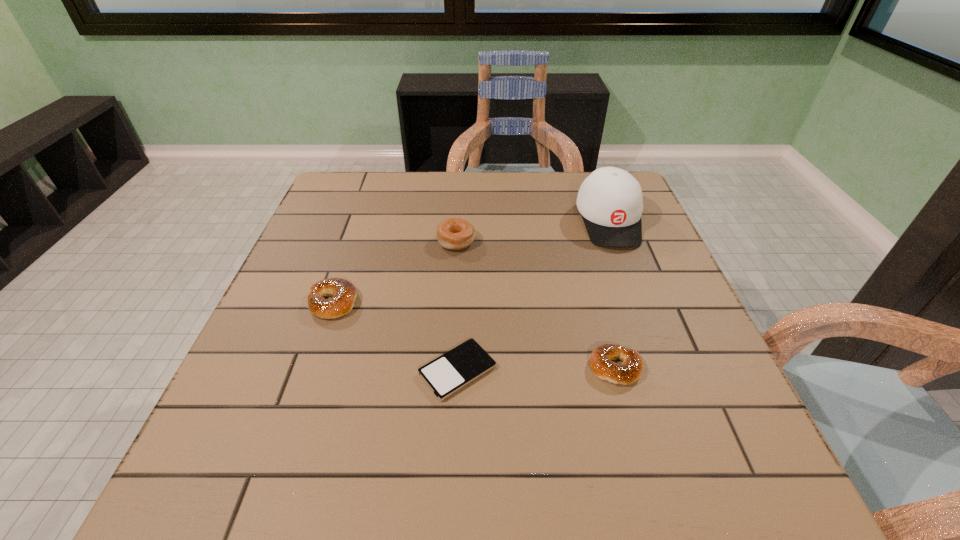
Locate an element on the screen. The height and width of the screenshot is (540, 960). free space at the left edge is located at coordinates (350, 260).

Identify the location of free space at the right edge. (621, 328).

You are a GUI agent. You are given a task and a screenshot of the screen. Output one action in this format:
    pyautogui.click(x=<x>, y=<y>)
    Task: Click on the vacant space at the far left corner of the desktop
    
    Given the screenshot: What is the action you would take?
    pyautogui.click(x=363, y=213)

This screenshot has width=960, height=540. What are the coordinates of `free location at the near left corner` in the screenshot? It's located at (216, 504).

This screenshot has width=960, height=540. In the image, there is a desktop. What are the coordinates of `vacant space at the near right corner` in the screenshot? It's located at (681, 502).

The width and height of the screenshot is (960, 540). I want to click on free space between the third nearest object and the farthest bagel, so click(x=395, y=272).

Find the location of a particular element. The image size is (960, 540). empty space that is in between the leftmost object and the tallest bagel is located at coordinates (395, 272).

You are a GUI agent. You are given a task and a screenshot of the screen. Output one action in this format:
    pyautogui.click(x=<x>, y=<y>)
    Task: Click on the free space between the third tallest object and the baseball cap
    
    Given the screenshot: What is the action you would take?
    pyautogui.click(x=470, y=262)

Where is `free space between the second shortest bagel and the baseball cap`? This screenshot has height=540, width=960. free space between the second shortest bagel and the baseball cap is located at coordinates (470, 262).

Where is `free point between the fourth tallest object and the baseball cap`? This screenshot has width=960, height=540. free point between the fourth tallest object and the baseball cap is located at coordinates (612, 294).